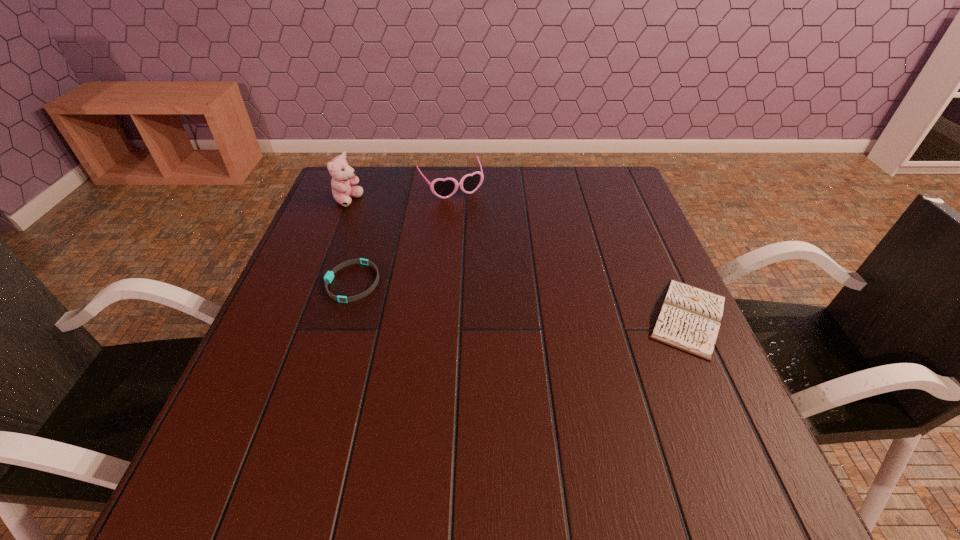
Identify the location of free region at the near edge of the desktop. Image resolution: width=960 pixels, height=540 pixels. (341, 423).

This screenshot has width=960, height=540. In the image, there is a desktop. Find the location of `vacant space at the left edge`. vacant space at the left edge is located at coordinates (274, 393).

In the image, there is a desktop. Where is `blank space at the right edge`? blank space at the right edge is located at coordinates (639, 375).

Identify the location of free space at the near left corner. This screenshot has width=960, height=540. (250, 430).

Locate an element on the screen. vacant area at the far right corner is located at coordinates (638, 205).

The height and width of the screenshot is (540, 960). Find the location of `empty space between the wristband and the diary`. empty space between the wristband and the diary is located at coordinates (520, 300).

Locate an element on the screen. The width and height of the screenshot is (960, 540). free space between the sunglasses and the diary is located at coordinates (569, 252).

I want to click on unoccupied area between the shortest object and the diary, so click(x=520, y=300).

You are a GUI agent. You are given a task and a screenshot of the screen. Output one action in this format:
    pyautogui.click(x=<x>, y=<y>)
    Task: Click on the vacant space that's between the shortest object and the teddy bear
    This screenshot has width=960, height=540.
    Given the screenshot: What is the action you would take?
    pyautogui.click(x=349, y=241)

The width and height of the screenshot is (960, 540). What are the coordinates of `unoccupied area between the shortest object and the second tallest object` in the screenshot? It's located at (401, 234).